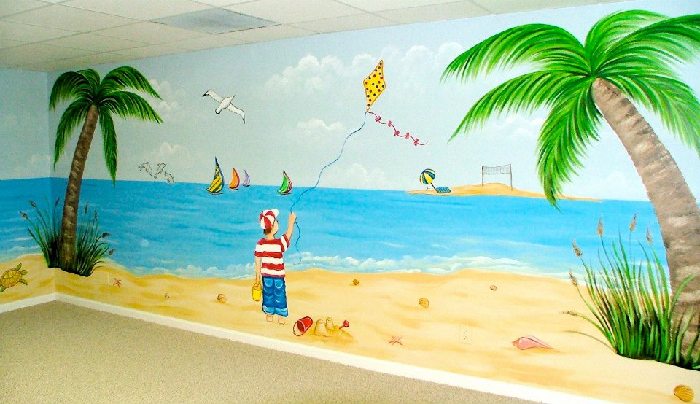
Where is `painting on wall`? The height and width of the screenshot is (404, 700). painting on wall is located at coordinates (376, 222).